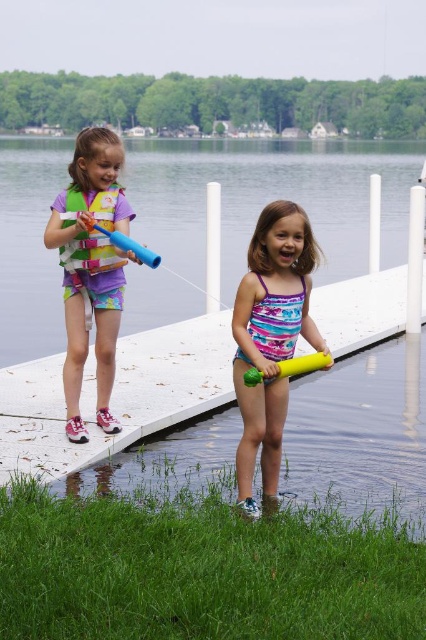
You are a parent supervising the children at the dock. You notice the transparent plastic water at center and the matte yellow float at center. Which object is closer to the children?

The transparent plastic water at center is closer to the children than the matte yellow float at center because the matte yellow float at center is positioned behind the transparent plastic water at center.

You are a parent supervising two kids playing near the water. You notice the matte yellow float at center and the yellow rubber tube at lower center. Which one is taller?

The matte yellow float at center is taller than the yellow rubber tube at lower center according to the description.

Based on the photo, you are a parent supervising two children playing near the water. You notice the matte yellow float at center and the yellow rubber tube at lower center. Which one is bigger?

The matte yellow float at center is larger in size compared to the yellow rubber tube at lower center.